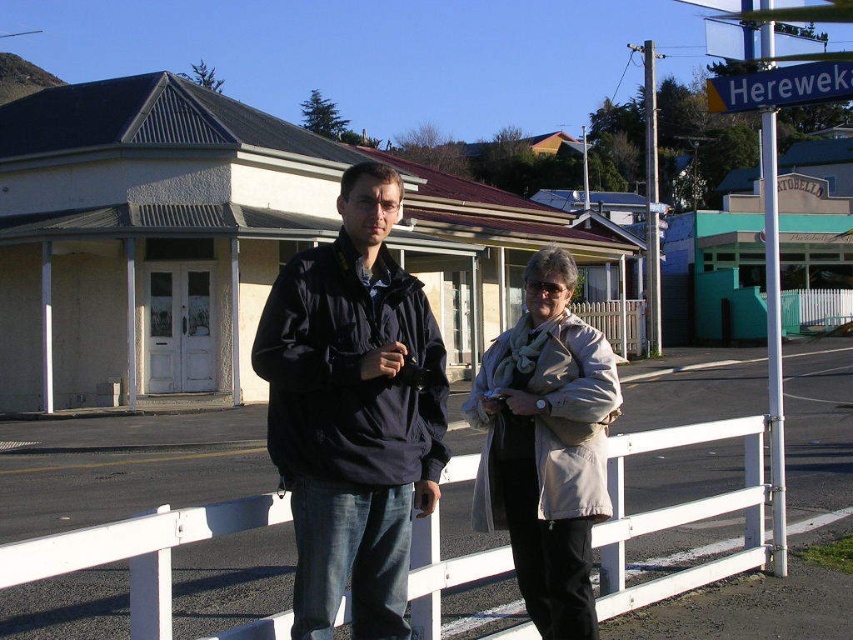
Question: Estimate the real-world distances between objects in this image. Which object is farther from the white plastic rail at center?

Choices:
 (A) beige fabric coat at center
 (B) dark blue jacket at center

Answer: (B)

Question: Which of the following is the farthest from the observer?

Choices:
 (A) (273, 630)
 (B) (299, 376)
 (C) (494, 422)

Answer: (C)

Question: Can you confirm if dark blue jacket at center is thinner than white plastic rail at center?

Choices:
 (A) yes
 (B) no

Answer: (A)

Question: Does white plastic rail at center come behind beige fabric coat at center?

Choices:
 (A) yes
 (B) no

Answer: (A)

Question: Which object appears farthest from the camera in this image?

Choices:
 (A) white plastic rail at center
 (B) dark blue jacket at center
 (C) beige fabric coat at center

Answer: (A)

Question: Does white plastic rail at center appear over beige fabric coat at center?

Choices:
 (A) no
 (B) yes

Answer: (A)